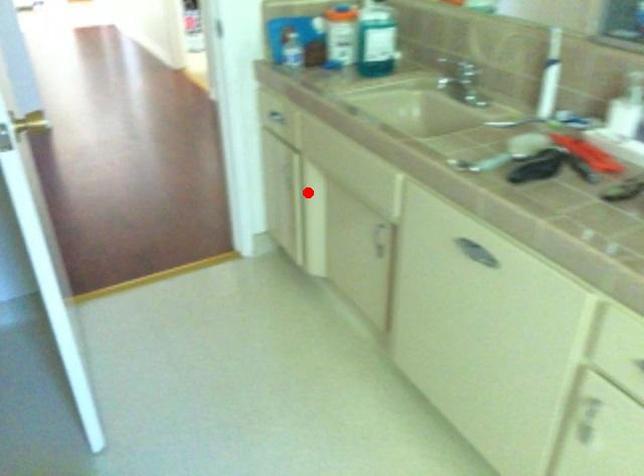
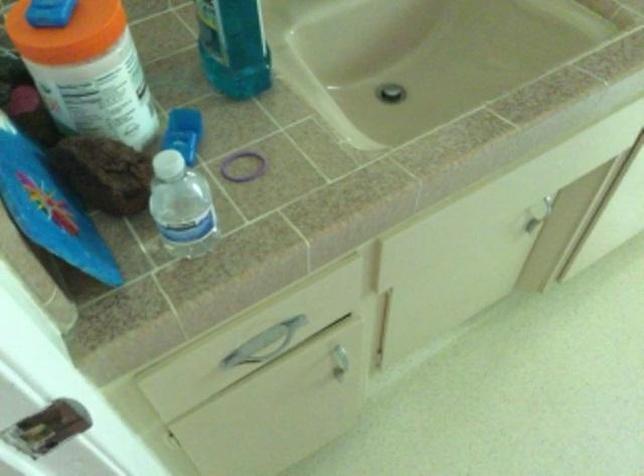
Question: I am providing you with two images of the same scene from different viewpoints. Image1 has a red point marked. In image2, the corresponding 3D location appears at what relative position? Reply with the corresponding letter.

Choices:
 (A) Closer
 (B) Farther

Answer: (A)